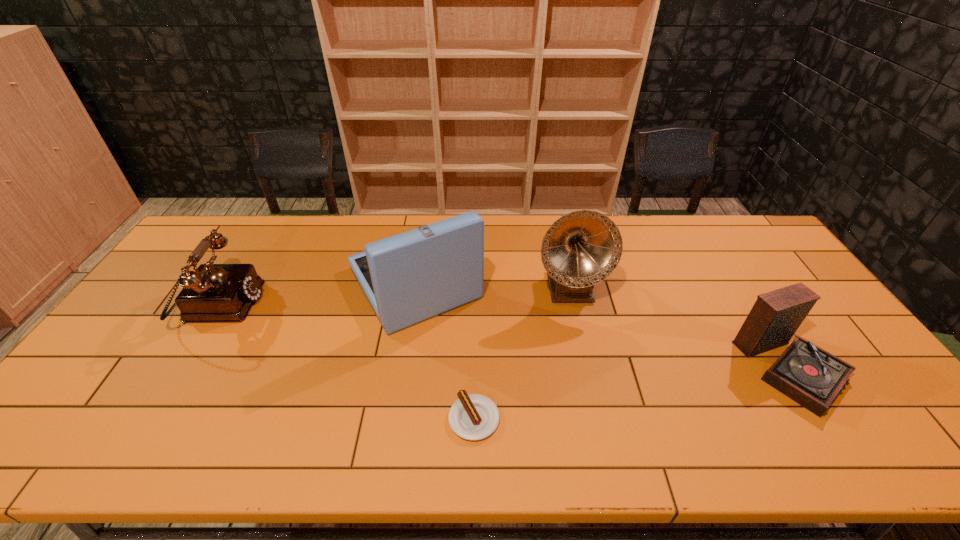
The width and height of the screenshot is (960, 540). Find the location of `vacant space located 0.050m on the back of the shortest object`. vacant space located 0.050m on the back of the shortest object is located at coordinates (474, 378).

At what (x,y) coordinates should I click in order to perform the action: click on object positioned at the far edge. Please return your answer as a coordinate pair (x, y). This screenshot has height=540, width=960. Looking at the image, I should click on (408, 278).

Find the location of a particular element. This screenshot has height=540, width=960. object located in the near edge section of the desktop is located at coordinates (473, 417).

Where is `object at the left edge`? This screenshot has height=540, width=960. object at the left edge is located at coordinates (213, 292).

Identify the location of object present at the right edge. pos(809,375).

This screenshot has width=960, height=540. In the image, there is a desktop. In order to click on vacant region at the far edge in this screenshot , I will do `click(644, 234)`.

Locate an element on the screen. The image size is (960, 540). free region at the near edge of the desktop is located at coordinates (698, 440).

You are a GUI agent. You are given a task and a screenshot of the screen. Output one action in this format:
    pyautogui.click(x=<x>, y=<y>)
    Task: Click on the free space at the left edge of the desktop
    This screenshot has height=540, width=960.
    Given the screenshot: What is the action you would take?
    pyautogui.click(x=167, y=300)

The width and height of the screenshot is (960, 540). I want to click on vacant space at the right edge of the desktop, so [x=789, y=277].

Find the location of `vacant point at the far left corner`. vacant point at the far left corner is located at coordinates (245, 225).